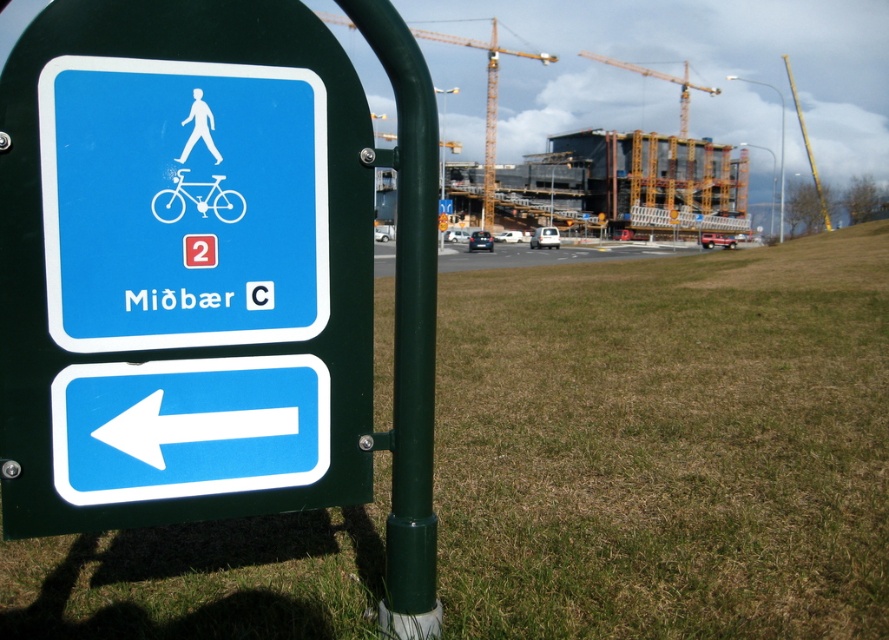
Question: Is blue plastic sign at left to the right of white glossy bicycle at center from the viewer's perspective?

Choices:
 (A) yes
 (B) no

Answer: (B)

Question: Can you confirm if blue plastic sign at left is positioned below blue plastic arrow at lower left?

Choices:
 (A) no
 (B) yes

Answer: (A)

Question: Which of the following is the farthest from the observer?

Choices:
 (A) white plastic arrow at lower left
 (B) matte plastic sign at left
 (C) yellow metallic crane at upper center

Answer: (C)

Question: Can you confirm if blue plastic sign at left is positioned above yellow metallic crane at upper center?

Choices:
 (A) yes
 (B) no

Answer: (B)

Question: Which of the following is the closest to the observer?

Choices:
 (A) (346, 266)
 (B) (426, 29)
 (C) (63, 138)

Answer: (C)

Question: Considering the real-world distances, which object is farthest from the white plastic arrow at lower left?

Choices:
 (A) matte plastic sign at left
 (B) blue plastic arrow at lower left
 (C) blue plastic sign at left

Answer: (C)